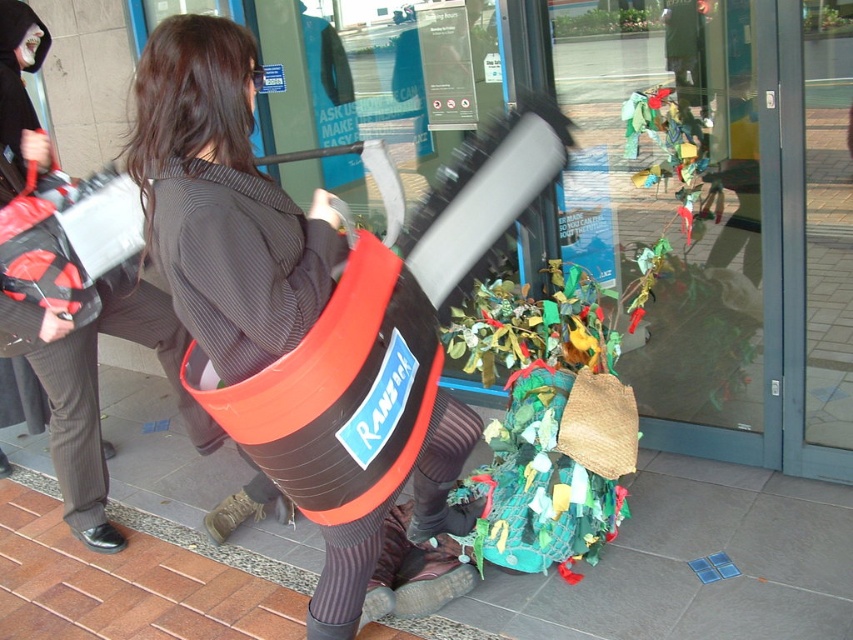
Question: Observing the image, what is the correct spatial positioning of transparent glass door at center in reference to matte black bag at center?

Choices:
 (A) above
 (B) below

Answer: (A)

Question: Which object is closer to the camera taking this photo?

Choices:
 (A) matte black bag at center
 (B) transparent glass door at center

Answer: (A)

Question: Does transparent glass door at center appear under matte black bag at center?

Choices:
 (A) yes
 (B) no

Answer: (B)

Question: Which object appears farthest from the camera in this image?

Choices:
 (A) transparent glass door at center
 (B) matte black bag at center

Answer: (A)

Question: Which object is farther from the camera taking this photo?

Choices:
 (A) transparent glass door at center
 (B) matte black bag at center

Answer: (A)

Question: Can you confirm if transparent glass door at center is smaller than matte black bag at center?

Choices:
 (A) no
 (B) yes

Answer: (A)